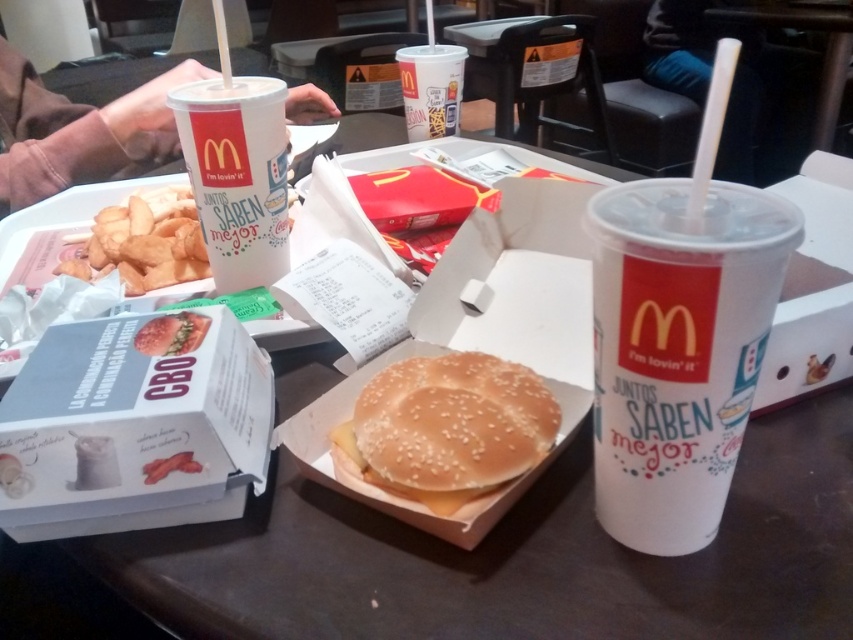
Question: Estimate the real-world distances between objects in this image. Which object is farther from the semi-glossy red burger at center?

Choices:
 (A) white paper cup at center
 (B) pink fabric hand at upper left

Answer: (B)

Question: Which point is farther to the camera?

Choices:
 (A) white paper cup at center
 (B) white cardboard box at center-left
 (C) semi-glossy red burger at center
 (D) sesame seed bun at center

Answer: (C)

Question: Which point is closer to the camera?

Choices:
 (A) golden crispy fries at lower left
 (B) white cardboard box at center-left

Answer: (B)

Question: Does sesame seed bun at center have a larger size compared to white paper cup at upper center?

Choices:
 (A) yes
 (B) no

Answer: (B)

Question: Can you confirm if white paper cup at center is smaller than white paper cup at upper left?

Choices:
 (A) yes
 (B) no

Answer: (B)

Question: Does sesame seed bun at center have a smaller size compared to white paper cup at upper center?

Choices:
 (A) yes
 (B) no

Answer: (A)